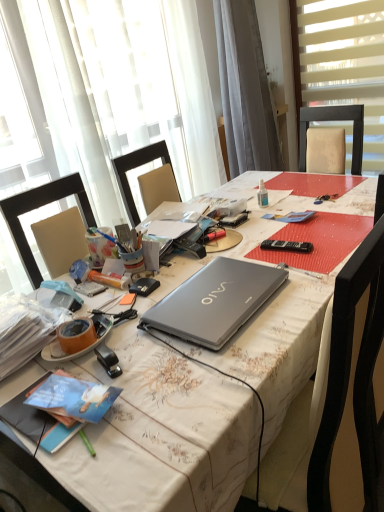
This screenshot has height=512, width=384. I want to click on free space between silver metallic laptop at center and black plastic remote control at center, so click(276, 259).